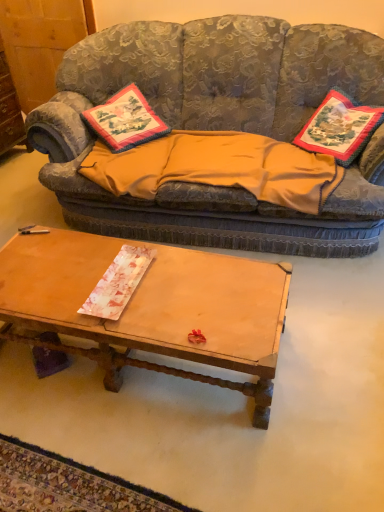
Where is `embroidered fabric pillow at right, marked as the first pillow in a right-to-left arrangement`? This screenshot has width=384, height=512. embroidered fabric pillow at right, marked as the first pillow in a right-to-left arrangement is located at coordinates pyautogui.click(x=340, y=127).

Describe the element at coordinates (147, 309) in the screenshot. I see `wooden coffee table at center` at that location.

Measure the distance between wooden dresser at left and camera.

wooden dresser at left is 2.94 meters away from camera.

Locate an element on the screen. Image resolution: width=384 pixels, height=512 pixels. orange fabric blanket at center is located at coordinates [x=219, y=167].

The width and height of the screenshot is (384, 512). What are the coordinates of `textured fabric couch at upper center` in the screenshot? It's located at (217, 128).

Find the location of `embroidered fabric pillow at right, marked as the first pillow in a right-to-left arrangement`. embroidered fabric pillow at right, marked as the first pillow in a right-to-left arrangement is located at coordinates (340, 127).

Which object is wider, wooden coffee table at center or textured fabric couch at upper center?

textured fabric couch at upper center.

From a real-world perspective, is wooden coffee table at center above or below textured fabric couch at upper center?

From a real-world perspective, wooden coffee table at center is physically below textured fabric couch at upper center.

Is wooden coffee table at center placed right next to textured fabric couch at upper center?

No, wooden coffee table at center is not with textured fabric couch at upper center.

Considering the relative sizes of wooden dresser at left and embroidered fabric pillow at right, which is the 2th pillow in left-to-right order, in the image provided, is wooden dresser at left wider than embroidered fabric pillow at right, which is the 2th pillow in left-to-right order,?

Incorrect, the width of wooden dresser at left does not surpass that of embroidered fabric pillow at right, which is the 2th pillow in left-to-right order.

Is wooden dresser at left taller or shorter than embroidered fabric pillow at right, marked as the first pillow in a right-to-left arrangement?

In the image, wooden dresser at left appears to be taller than embroidered fabric pillow at right, marked as the first pillow in a right-to-left arrangement.

Is wooden dresser at left in front of or behind embroidered fabric pillow at right, marked as the first pillow in a right-to-left arrangement, in the image?

In the image, wooden dresser at left appears behind embroidered fabric pillow at right, marked as the first pillow in a right-to-left arrangement.

Is wooden dresser at left located outside embroidered fabric pillow at right, marked as the first pillow in a right-to-left arrangement?

Yes, wooden dresser at left is located beyond the bounds of embroidered fabric pillow at right, marked as the first pillow in a right-to-left arrangement.

Between embroidered fabric pillow at right, which is the 2th pillow in left-to-right order, and wooden dresser at left, which one has smaller width?

wooden dresser at left is thinner.

Considering the relative sizes of embroidered fabric pillow at right, marked as the first pillow in a right-to-left arrangement, and wooden dresser at left in the image provided, is embroidered fabric pillow at right, marked as the first pillow in a right-to-left arrangement, taller than wooden dresser at left?

In fact, embroidered fabric pillow at right, marked as the first pillow in a right-to-left arrangement, may be shorter than wooden dresser at left.

What's the angular difference between embroidered fabric pillow at right, marked as the first pillow in a right-to-left arrangement, and wooden dresser at left's facing directions?

The facing directions of embroidered fabric pillow at right, marked as the first pillow in a right-to-left arrangement, and wooden dresser at left are 119 degrees apart.

From a real-world perspective, is embroidered fabric pillow at right, marked as the first pillow in a right-to-left arrangement, physically below wooden dresser at left?

Incorrect, from a real-world perspective, embroidered fabric pillow at right, marked as the first pillow in a right-to-left arrangement, is higher than wooden dresser at left.

Looking at this image, is wooden coffee table at center oriented towards orange fabric blanket at center?

No, wooden coffee table at center is not oriented towards orange fabric blanket at center.

Is wooden coffee table at center far from orange fabric blanket at center?

No, there isn't a large distance between wooden coffee table at center and orange fabric blanket at center.

Is wooden coffee table at center located outside orange fabric blanket at center?

That's correct, wooden coffee table at center is outside of orange fabric blanket at center.

Can you confirm if wooden coffee table at center is smaller than orange fabric blanket at center?

No.

From a real-world perspective, which is physically below, embroidered fabric pillow at center, placed as the second pillow when sorted from right to left, or wooden coffee table at center?

wooden coffee table at center, from a real-world perspective.

From the image's perspective, which object appears higher, embroidered fabric pillow at center, placed as the second pillow when sorted from right to left, or wooden coffee table at center?

embroidered fabric pillow at center, placed as the second pillow when sorted from right to left, appears higher in the image.

Can you tell me how much embroidered fabric pillow at center, placed as the second pillow when sorted from right to left, and wooden coffee table at center differ in facing direction?

The facing directions of embroidered fabric pillow at center, placed as the second pillow when sorted from right to left, and wooden coffee table at center are 54.6 degrees apart.

Does embroidered fabric pillow at center, placed as the second pillow when sorted from right to left, turn towards wooden coffee table at center?

No, embroidered fabric pillow at center, placed as the second pillow when sorted from right to left, is not aimed at wooden coffee table at center.

Does orange fabric blanket at center have a lesser height compared to textured fabric couch at upper center?

Correct, orange fabric blanket at center is not as tall as textured fabric couch at upper center.

Is point (252, 189) closer to camera compared to point (90, 195)?

Yes, it is in front of point (90, 195).

From the image's perspective, which is below, orange fabric blanket at center or textured fabric couch at upper center?

orange fabric blanket at center appears lower in the image.

Identify the location of blanket on the left of textured fabric couch at upper center. This screenshot has width=384, height=512. (219, 167).

Find the location of a particular element. Image resolution: width=384 pixels, height=512 pixels. pillow that is the 1st object above the wooden dresser at left (from a real-world perspective) is located at coordinates (125, 120).

Is embroidered fabric pillow at center, placed as the second pillow when sorted from right to left, surrounded by wooden dresser at left?

No.

In the scene shown: Between wooden dresser at left and embroidered fabric pillow at center, placed as the second pillow when sorted from right to left, which one has more height?

wooden dresser at left is taller.

Is wooden dresser at left next to embroidered fabric pillow at center, placed as the second pillow when sorted from right to left?

No, wooden dresser at left is not with embroidered fabric pillow at center, placed as the second pillow when sorted from right to left.

Locate an element on the screen. This screenshot has height=512, width=384. coffee table in front of the textured fabric couch at upper center is located at coordinates (147, 309).

Where is `dresser behind the embroidered fabric pillow at right, which is the 2th pillow in left-to-right order`? This screenshot has width=384, height=512. dresser behind the embroidered fabric pillow at right, which is the 2th pillow in left-to-right order is located at coordinates tap(9, 112).

Which object lies further to the anchor point wooden dresser at left, embroidered fabric pillow at center, placed as the second pillow when sorted from right to left, or embroidered fabric pillow at right, marked as the first pillow in a right-to-left arrangement?

embroidered fabric pillow at right, marked as the first pillow in a right-to-left arrangement, is further to wooden dresser at left.

Estimate the real-world distances between objects in this image. Which object is closer to orange fabric blanket at center, embroidered fabric pillow at center, the first pillow in the left-to-right sequence, or textured fabric couch at upper center?

textured fabric couch at upper center.

Looking at the image, which one is located closer to wooden coffee table at center, embroidered fabric pillow at center, placed as the second pillow when sorted from right to left, or wooden dresser at left?

Based on the image, embroidered fabric pillow at center, placed as the second pillow when sorted from right to left, appears to be nearer to wooden coffee table at center.

Looking at the image, which one is located closer to textured fabric couch at upper center, orange fabric blanket at center or embroidered fabric pillow at right, which is the 2th pillow in left-to-right order?

The object closer to textured fabric couch at upper center is orange fabric blanket at center.

Estimate the real-world distances between objects in this image. Which object is further from embroidered fabric pillow at right, marked as the first pillow in a right-to-left arrangement, embroidered fabric pillow at center, the first pillow in the left-to-right sequence, or orange fabric blanket at center?

embroidered fabric pillow at center, the first pillow in the left-to-right sequence, lies further to embroidered fabric pillow at right, marked as the first pillow in a right-to-left arrangement, than the other object.

Considering their positions, is orange fabric blanket at center positioned closer to textured fabric couch at upper center than wooden dresser at left?

orange fabric blanket at center is positioned closer to the anchor textured fabric couch at upper center.

Based on their spatial positions, is orange fabric blanket at center or wooden dresser at left closer to embroidered fabric pillow at center, placed as the second pillow when sorted from right to left?

Based on the image, orange fabric blanket at center appears to be nearer to embroidered fabric pillow at center, placed as the second pillow when sorted from right to left.

Based on their spatial positions, is textured fabric couch at upper center or embroidered fabric pillow at right, which is the 2th pillow in left-to-right order, further from embroidered fabric pillow at center, placed as the second pillow when sorted from right to left?

Based on the image, embroidered fabric pillow at right, which is the 2th pillow in left-to-right order, appears to be further to embroidered fabric pillow at center, placed as the second pillow when sorted from right to left.

The image size is (384, 512). In order to click on pillow between wooden dresser at left and embroidered fabric pillow at right, marked as the first pillow in a right-to-left arrangement, in the horizontal direction in this screenshot , I will do `click(125, 120)`.

Identify the location of blanket between embroidered fabric pillow at center, the first pillow in the left-to-right sequence, and wooden coffee table at center in the up-down direction. (219, 167).

Image resolution: width=384 pixels, height=512 pixels. I want to click on pillow located between wooden dresser at left and textured fabric couch at upper center in the left-right direction, so click(x=125, y=120).

I want to click on blanket between textured fabric couch at upper center and embroidered fabric pillow at center, the first pillow in the left-to-right sequence, from front to back, so click(x=219, y=167).